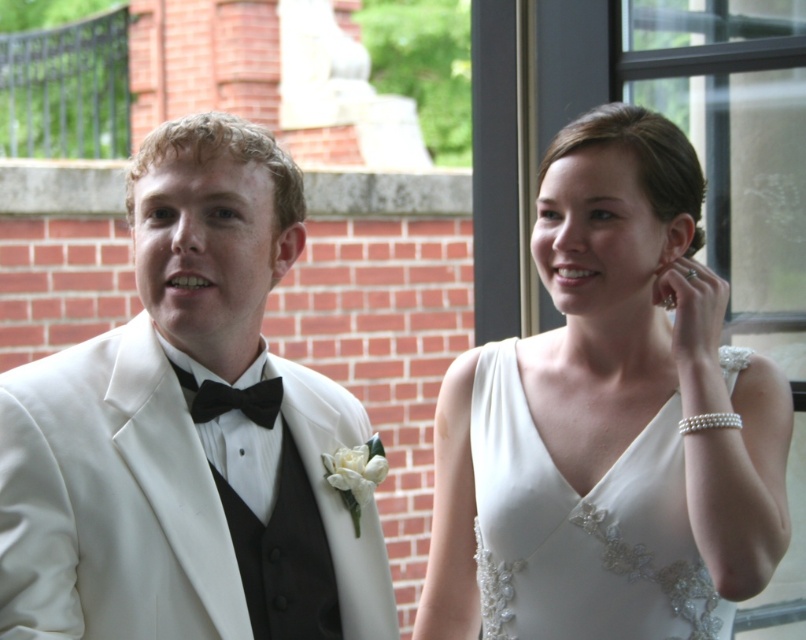
Question: Which object appears closest to the camera in this image?

Choices:
 (A) white satin tuxedo at left
 (B) white satin dress at upper right

Answer: (A)

Question: Observing the image, what is the correct spatial positioning of white satin dress at upper right in reference to black velvet bow tie at center?

Choices:
 (A) below
 (B) above

Answer: (A)

Question: Which point is closer to the camera taking this photo?

Choices:
 (A) (276, 406)
 (B) (721, 353)
 (C) (696, 275)
 (D) (235, 492)

Answer: (D)

Question: Estimate the real-world distances between objects in this image. Which object is farther from the white satin dress at upper right?

Choices:
 (A) black velvet bow tie at center
 (B) white satin tuxedo at left

Answer: (A)

Question: Observing the image, what is the correct spatial positioning of white satin dress at center in reference to black velvet bow tie at center?

Choices:
 (A) left
 (B) right

Answer: (B)

Question: Does white satin dress at center appear on the right side of white satin dress at upper right?

Choices:
 (A) no
 (B) yes

Answer: (B)